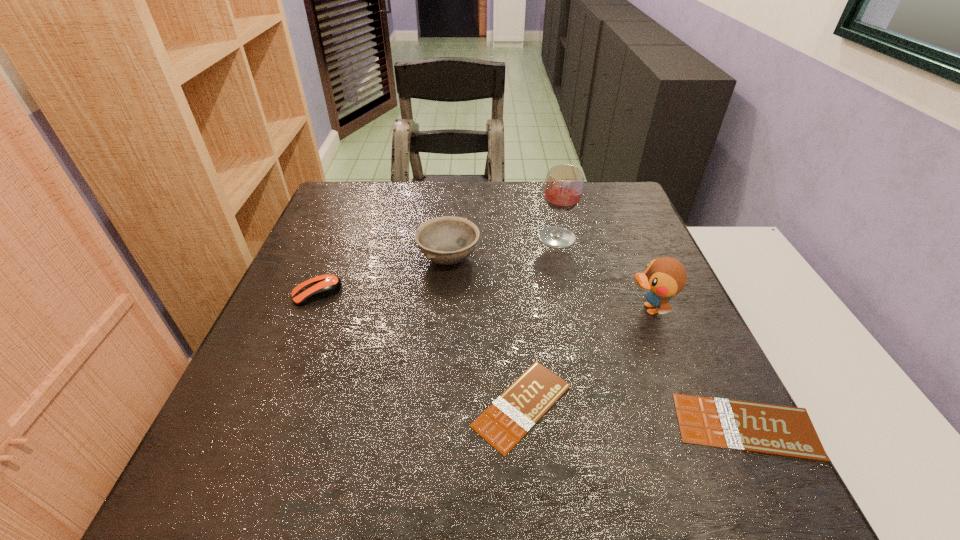
Locate an element on the screen. The width and height of the screenshot is (960, 540). object that is at the near right corner is located at coordinates (786, 431).

Identify the location of vacant space at the far edge of the desktop. This screenshot has height=540, width=960. (488, 210).

Locate an element on the screen. The width and height of the screenshot is (960, 540). blank space at the near edge of the desktop is located at coordinates (620, 420).

Locate an element on the screen. This screenshot has height=540, width=960. vacant area at the left edge is located at coordinates (308, 239).

Find the location of a particular element. This screenshot has width=960, height=540. vacant space at the right edge of the desktop is located at coordinates (674, 344).

You are a GUI agent. You are given a task and a screenshot of the screen. Output one action in this format:
    pyautogui.click(x=<x>, y=<y>)
    Task: Click on the free location at the far left corner
    The width and height of the screenshot is (960, 540).
    Given the screenshot: What is the action you would take?
    pyautogui.click(x=326, y=208)

In the image, there is a desktop. Where is `free space at the near left corner`? free space at the near left corner is located at coordinates (227, 427).

In the image, there is a desktop. In order to click on vacant space at the far right corner in this screenshot , I will do `click(636, 219)`.

The image size is (960, 540). Identify the location of free space between the third shortest object and the fifth tallest object. (531, 360).

This screenshot has width=960, height=540. I want to click on vacant area between the computer mouse and the fifth shortest object, so click(483, 301).